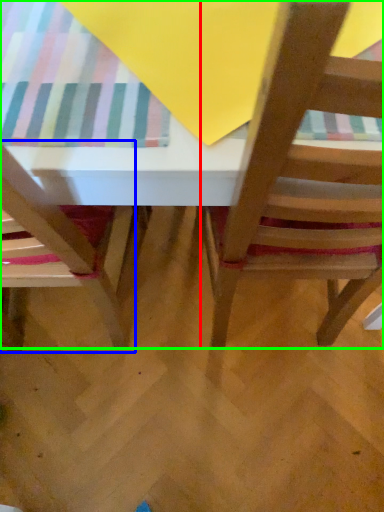
Question: Considering the real-world distances, which object is farthest from chair (highlighted by a red box)? chair (highlighted by a blue box) or table (highlighted by a green box)?

Choices:
 (A) chair
 (B) table

Answer: (A)